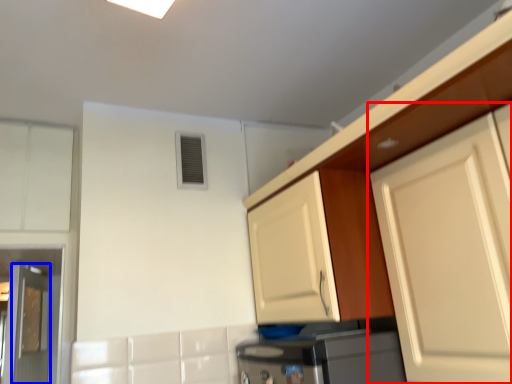
Question: Among these objects, which one is farthest to the camera, cabinetry (highlighted by a red box) or door (highlighted by a blue box)?

Choices:
 (A) cabinetry
 (B) door

Answer: (B)